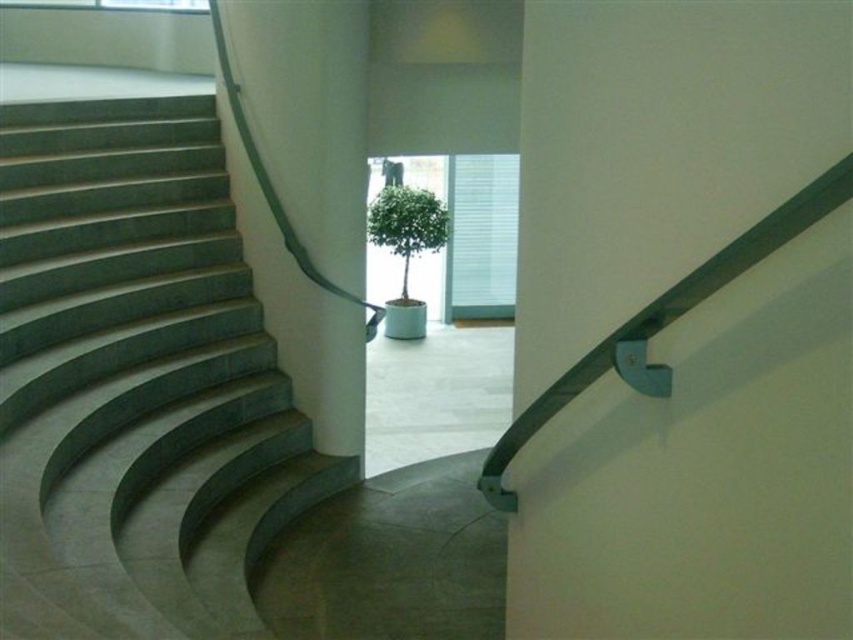
Does green matte handrail at upper right appear on the right side of green matte plant at center?

Correct, you'll find green matte handrail at upper right to the right of green matte plant at center.

Is green matte handrail at upper right bigger than green matte plant at center?

Actually, green matte handrail at upper right might be smaller than green matte plant at center.

The height and width of the screenshot is (640, 853). I want to click on green matte handrail at upper right, so click(x=663, y=323).

Find the location of a particular element. The image size is (853, 640). green matte handrail at upper right is located at coordinates (663, 323).

Who is more forward, (x=419, y=227) or (x=300, y=264)?

Positioned in front is point (x=300, y=264).

Does green matte plant at center lie in front of white smooth pillar at center?

No.

Between point (384, 232) and point (219, 64), which one is positioned behind?

Positioned behind is point (384, 232).

The width and height of the screenshot is (853, 640). Find the location of `green matte plant at center`. green matte plant at center is located at coordinates (407, 225).

Is green polished concrete stairs at left shorter than green matte handrail at upper right?

In fact, green polished concrete stairs at left may be taller than green matte handrail at upper right.

Which is above, green polished concrete stairs at left or green matte handrail at upper right?

green polished concrete stairs at left is above.

Is point (27, 211) positioned behind point (625, 376)?

Yes, point (27, 211) is behind point (625, 376).

The height and width of the screenshot is (640, 853). I want to click on green polished concrete stairs at left, so click(x=137, y=384).